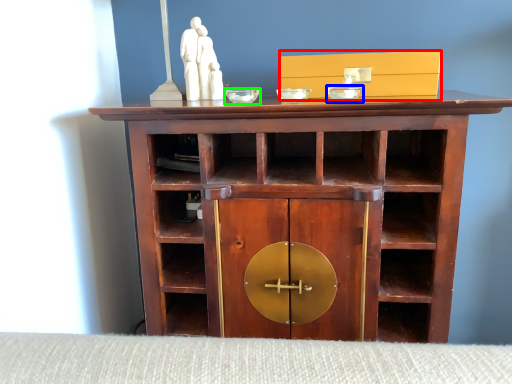
Question: Which object is the closest to the cabinetry (highlighted by a red box)? Choose among these: glass bowl (highlighted by a blue box) or glass bowl (highlighted by a green box).

Choices:
 (A) glass bowl
 (B) glass bowl

Answer: (A)